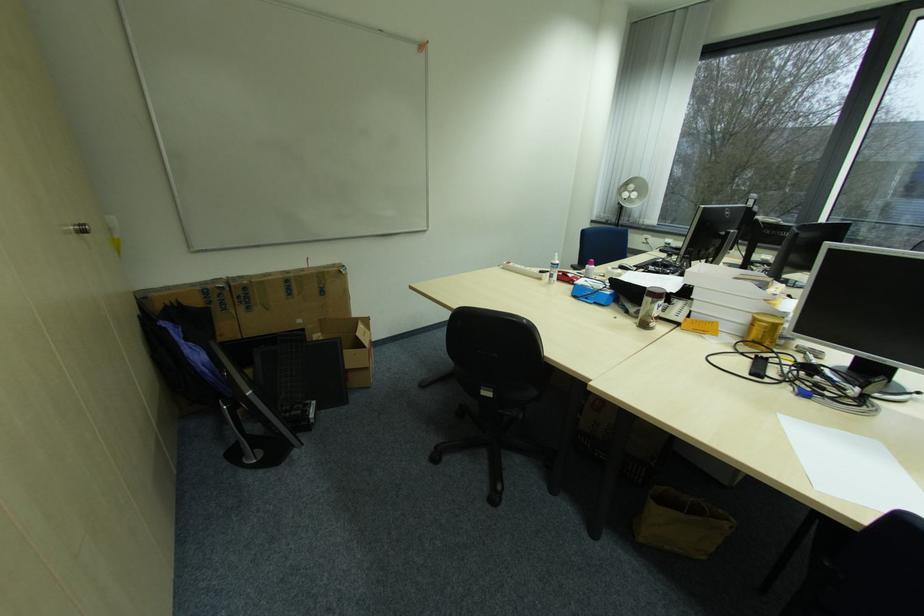
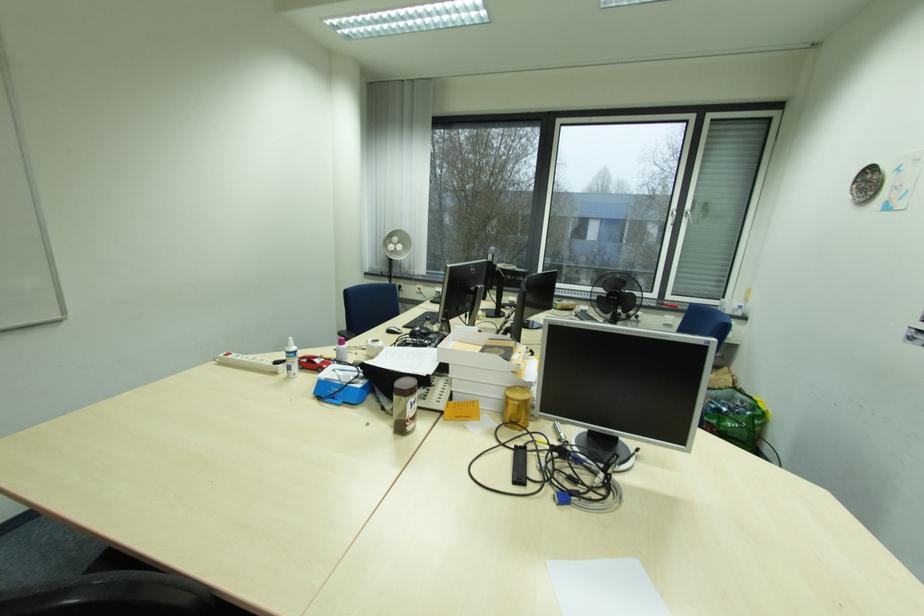
Question: The first image is from the beginning of the video and the second image is from the end. How did the camera likely rotate when shooting the video?

Choices:
 (A) Left
 (B) Right
 (C) Up
 (D) Down

Answer: (B)